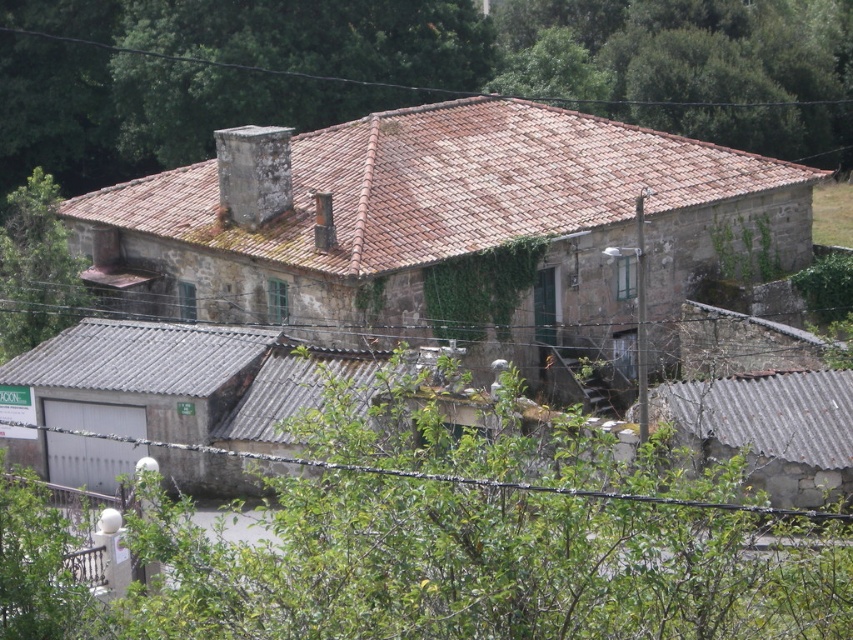
Question: Is brown tile roof at upper center smaller than green leafy tree at upper left?

Choices:
 (A) yes
 (B) no

Answer: (B)

Question: Is brown tile roof at upper center to the right of green leafy tree at upper left from the viewer's perspective?

Choices:
 (A) yes
 (B) no

Answer: (A)

Question: Is brown tile roof at upper center thinner than green leafy tree at upper left?

Choices:
 (A) no
 (B) yes

Answer: (A)

Question: Which of the following is the closest to the observer?

Choices:
 (A) brown tile roof at upper center
 (B) green leafy tree at upper left

Answer: (B)